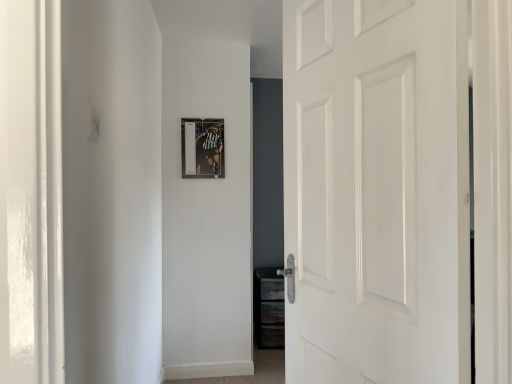
What is the approximate width of metallic silver picture frame at center?

1.21 inches.

The width and height of the screenshot is (512, 384). I want to click on metallic silver picture frame at center, so click(x=202, y=148).

Image resolution: width=512 pixels, height=384 pixels. What do you see at coordinates (202, 148) in the screenshot?
I see `metallic silver picture frame at center` at bounding box center [202, 148].

This screenshot has height=384, width=512. What are the coordinates of `metallic silver picture frame at center` in the screenshot? It's located at (202, 148).